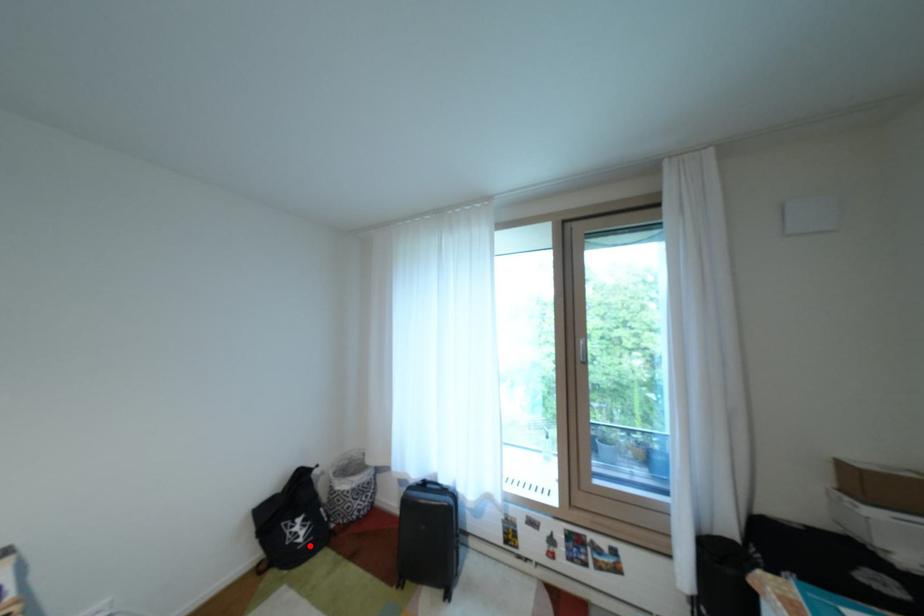
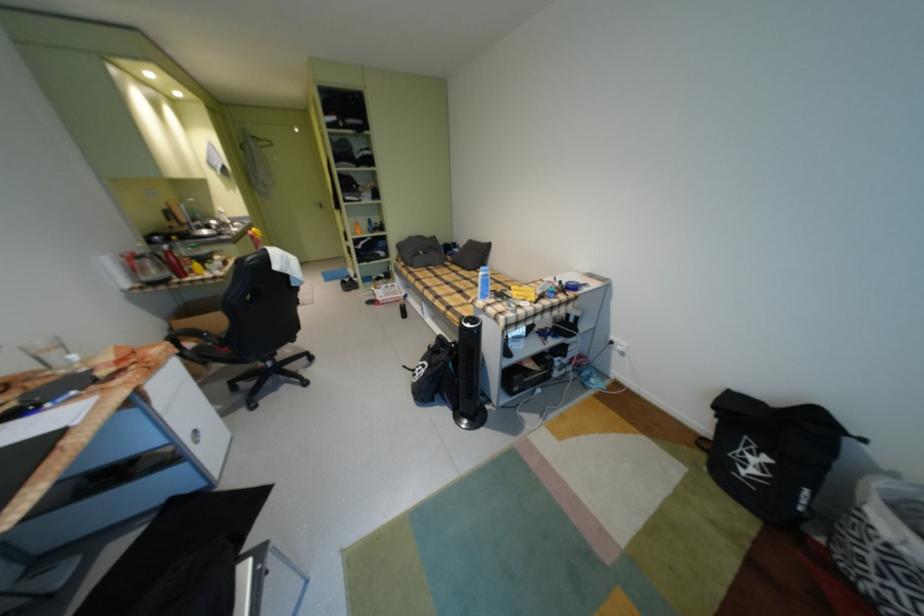
Locate, in the second image, the point that corresponds to the highlighted location in the first image.

(748, 474)